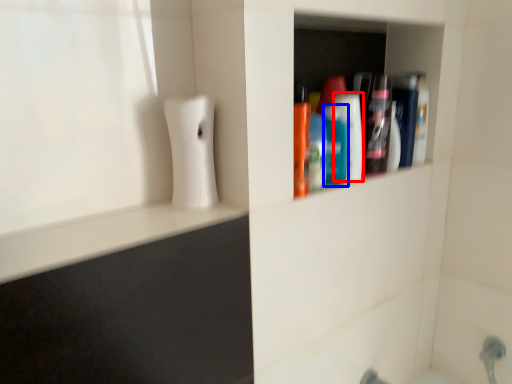
Question: Among these objects, which one is nearest to the camera, mouthwash (highlighted by a red box) or mouthwash (highlighted by a blue box)?

Choices:
 (A) mouthwash
 (B) mouthwash

Answer: (B)